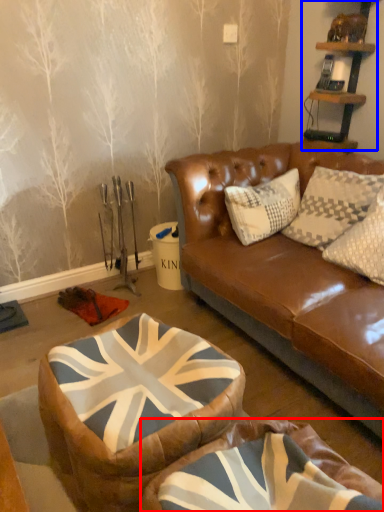
Question: Which point is further to the camera, bean bag chair (highlighted by a red box) or shelf (highlighted by a blue box)?

Choices:
 (A) bean bag chair
 (B) shelf

Answer: (B)